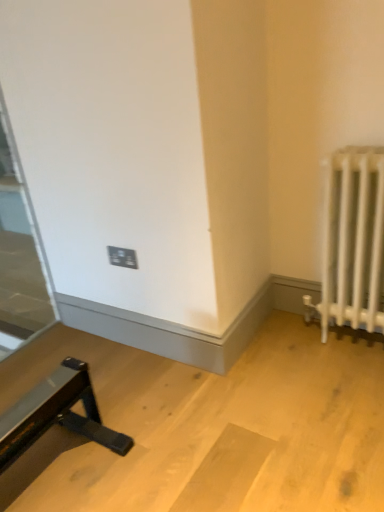
Question: From the image's perspective, is white metal radiator at right located beneath transparent glass door at left?

Choices:
 (A) yes
 (B) no

Answer: (A)

Question: From a real-world perspective, is white metal radiator at right physically above transparent glass door at left?

Choices:
 (A) yes
 (B) no

Answer: (B)

Question: Considering the relative sizes of white metal radiator at right and transparent glass door at left in the image provided, is white metal radiator at right shorter than transparent glass door at left?

Choices:
 (A) yes
 (B) no

Answer: (A)

Question: Is white metal radiator at right taller than transparent glass door at left?

Choices:
 (A) yes
 (B) no

Answer: (B)

Question: Is white metal radiator at right positioned beyond the bounds of transparent glass door at left?

Choices:
 (A) no
 (B) yes

Answer: (B)

Question: Is white metal radiator at right aimed at transparent glass door at left?

Choices:
 (A) no
 (B) yes

Answer: (A)

Question: Considering the relative positions of white metal radiator at right and black plastic outlet at center in the image provided, is white metal radiator at right in front of black plastic outlet at center?

Choices:
 (A) yes
 (B) no

Answer: (A)

Question: From a real-world perspective, is white metal radiator at right physically below black plastic outlet at center?

Choices:
 (A) yes
 (B) no

Answer: (A)

Question: Is white metal radiator at right touching black plastic outlet at center?

Choices:
 (A) yes
 (B) no

Answer: (B)

Question: Is white metal radiator at right aimed at black plastic outlet at center?

Choices:
 (A) yes
 (B) no

Answer: (B)

Question: Is the depth of white metal radiator at right greater than that of black plastic outlet at center?

Choices:
 (A) no
 (B) yes

Answer: (A)

Question: Is there a large distance between white metal radiator at right and black plastic outlet at center?

Choices:
 (A) no
 (B) yes

Answer: (A)

Question: From the image's perspective, would you say black plastic outlet at center is shown under transparent glass door at left?

Choices:
 (A) no
 (B) yes

Answer: (B)